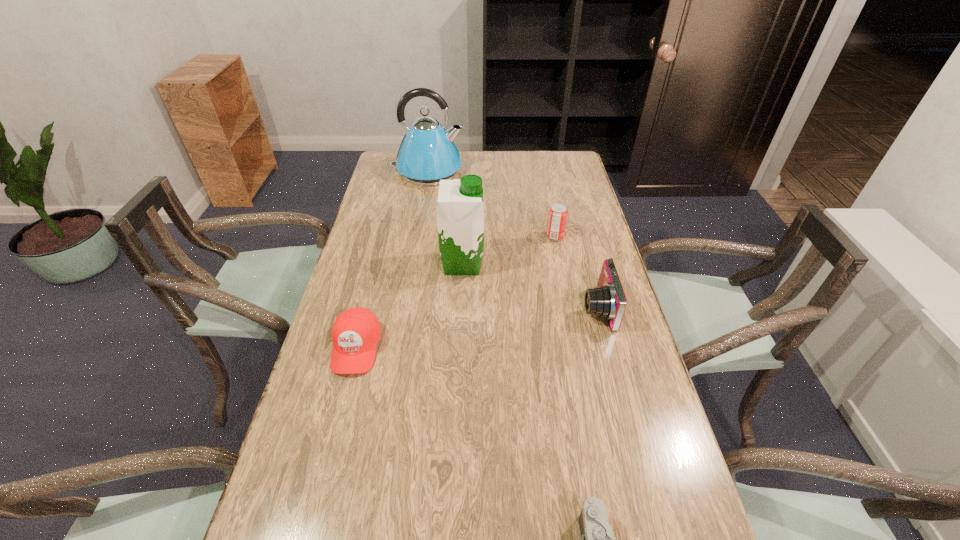
In the image, there is a desktop. In order to click on free space at the right edge in this screenshot , I will do `click(576, 197)`.

The height and width of the screenshot is (540, 960). What are the coordinates of `vacant region at the far right corner of the desktop` in the screenshot? It's located at (565, 170).

At what (x,y) coordinates should I click in order to perform the action: click on unoccupied area between the soya milk and the fifth tallest object. Please return your answer as a coordinate pair (x, y). Looking at the image, I should click on (409, 306).

Identify the location of free space between the fifth nearest object and the farthest object. The height and width of the screenshot is (540, 960). (492, 204).

Select which object appears as the third closest to the baseball cap. Please provide its 2D coordinates. Your answer should be formatted as a tuple, i.e. [(x, y)], where the tuple contains the x and y coordinates of a point satisfying the conditions above.

[(607, 300)]

Select which object is the fourth closest to the soda can. Please provide its 2D coordinates. Your answer should be formatted as a tuple, i.e. [(x, y)], where the tuple contains the x and y coordinates of a point satisfying the conditions above.

[(356, 331)]

Locate an element on the screen. vacant space that satisfies the following two spatial constraints: 1. at the spout of the farthest object; 2. on the left side of the soda can is located at coordinates (417, 237).

Identify the location of free space that satisfies the following two spatial constraints: 1. at the spout of the farthest object; 2. on the front panel of the second shortest object. This screenshot has height=540, width=960. (397, 348).